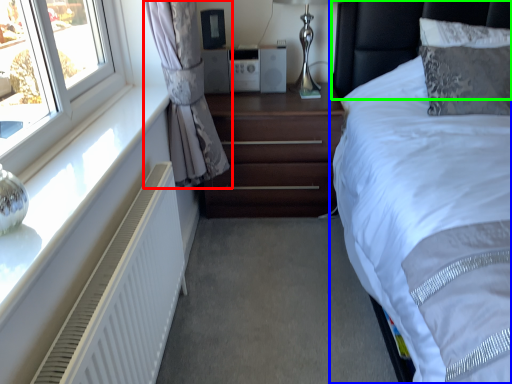
Question: Considering the real-world distances, which object is farthest from curtain (highlighted by a red box)? bed (highlighted by a blue box) or headboard (highlighted by a green box)?

Choices:
 (A) bed
 (B) headboard

Answer: (B)